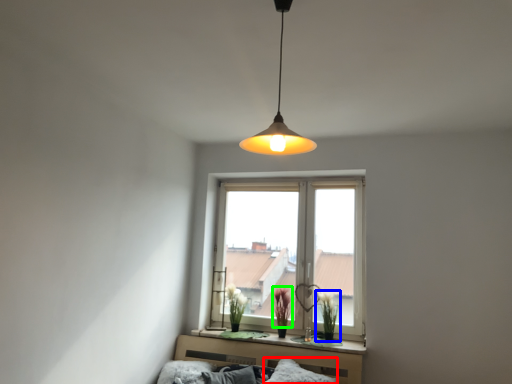
Question: Considering the real-world distances, which object is farthest from pillow (highlighted by a red box)? plant (highlighted by a blue box) or plant (highlighted by a green box)?

Choices:
 (A) plant
 (B) plant

Answer: (B)